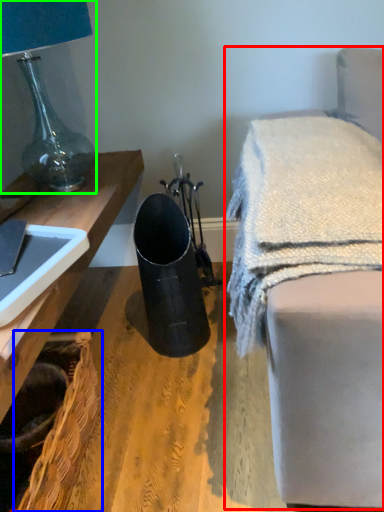
Question: Estimate the real-world distances between objects in this image. Which object is farther from furniture (highlighted by a red box), basket (highlighted by a blue box) or lamp (highlighted by a green box)?

Choices:
 (A) basket
 (B) lamp

Answer: (B)